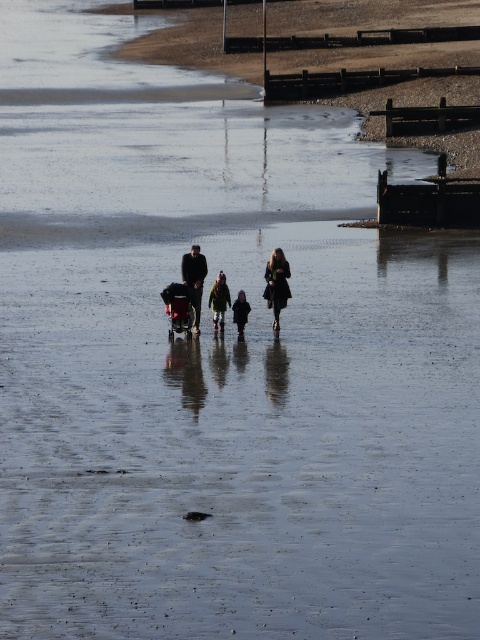
You are a photographer trying to capture a family photo. You notice two family members wearing a green fabric jacket at center and a dark blue coat at center. Since your camera has a limited field of view, you need to know which clothing item takes up more horizontal space. Which one is wider?

The green fabric jacket at center might be wider than dark blue coat at center, so the green fabric jacket at center likely takes up more horizontal space.

You are a photographer trying to capture the family at the beach. You notice the dark brown leather coat at center and the green fabric jacket at center. Which clothing item is covering the other?

The dark brown leather coat at center is positioned over the green fabric jacket at center, so it is covering the jacket.